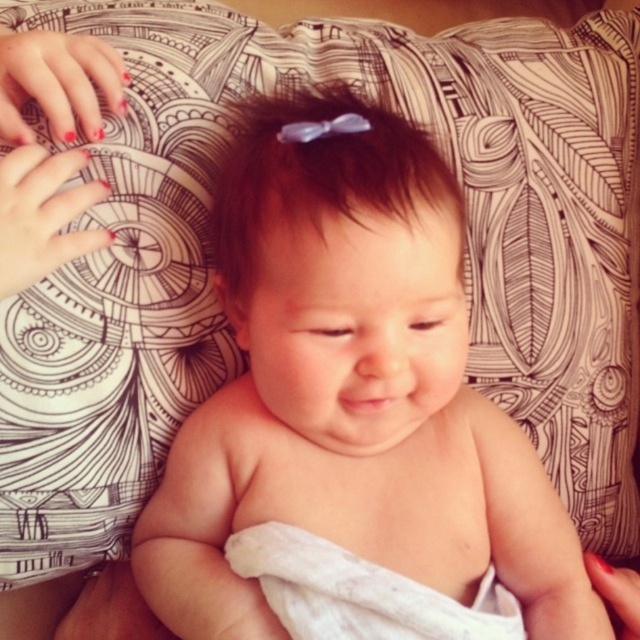
Question: Based on their relative distances, which object is nearer to the white cloth diaper at center?

Choices:
 (A) brown matte hair bow at center
 (B) smooth skin baby at center

Answer: (B)

Question: Which point is closer to the camera?

Choices:
 (A) (436, 602)
 (B) (384, 202)
 (C) (452, 592)

Answer: (B)

Question: Is smooth skin baby at center smaller than white cloth diaper at center?

Choices:
 (A) no
 (B) yes

Answer: (A)

Question: Is smooth skin baby at center thinner than white cloth diaper at center?

Choices:
 (A) yes
 (B) no

Answer: (B)

Question: Which object is closer to the camera taking this photo?

Choices:
 (A) smooth skin baby at center
 (B) brown matte hair bow at center
 (C) white cloth diaper at center

Answer: (B)

Question: Does smooth skin baby at center appear on the right side of white cloth diaper at center?

Choices:
 (A) no
 (B) yes

Answer: (A)